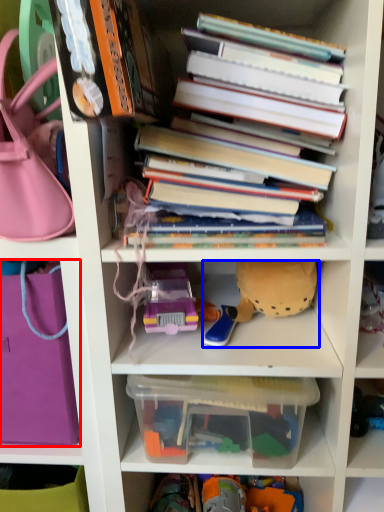
Question: Which object appears farthest to the camera in this image, handbag (highlighted by a red box) or toy (highlighted by a blue box)?

Choices:
 (A) handbag
 (B) toy

Answer: (B)